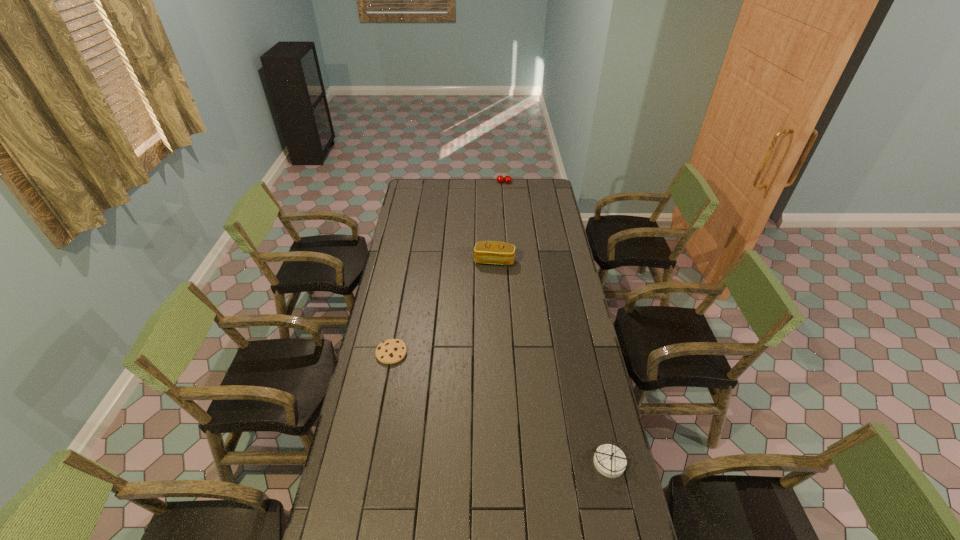
The width and height of the screenshot is (960, 540). Find the location of `cookie`. cookie is located at coordinates (391, 351).

Locate an element on the screen. the leftmost object is located at coordinates (391, 351).

Locate an element on the screen. This screenshot has width=960, height=540. compass is located at coordinates (609, 460).

Locate an element on the screen. This screenshot has width=960, height=540. the nearest object is located at coordinates (609, 460).

Where is `the farthest object`? This screenshot has width=960, height=540. the farthest object is located at coordinates (500, 179).

This screenshot has width=960, height=540. In order to click on cherry in this screenshot , I will do `click(500, 179)`.

The image size is (960, 540). Find the location of `clutch bag`. clutch bag is located at coordinates (489, 252).

Locate an element on the screen. This screenshot has height=540, width=960. the third nearest object is located at coordinates (489, 252).

Identify the location of vacant space located 0.320m on the back of the leftmost object. Image resolution: width=960 pixels, height=540 pixels. (403, 288).

Identify the location of blank space located on the back of the rightmost object. The height and width of the screenshot is (540, 960). (598, 411).